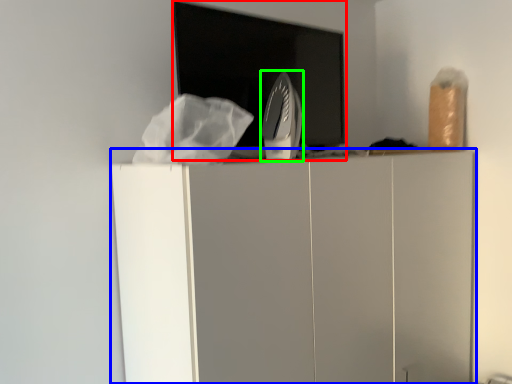
Question: Which is nearer to the appliance (highlighted by a red box)? furniture (highlighted by a blue box) or home appliance (highlighted by a green box).

Choices:
 (A) furniture
 (B) home appliance

Answer: (B)